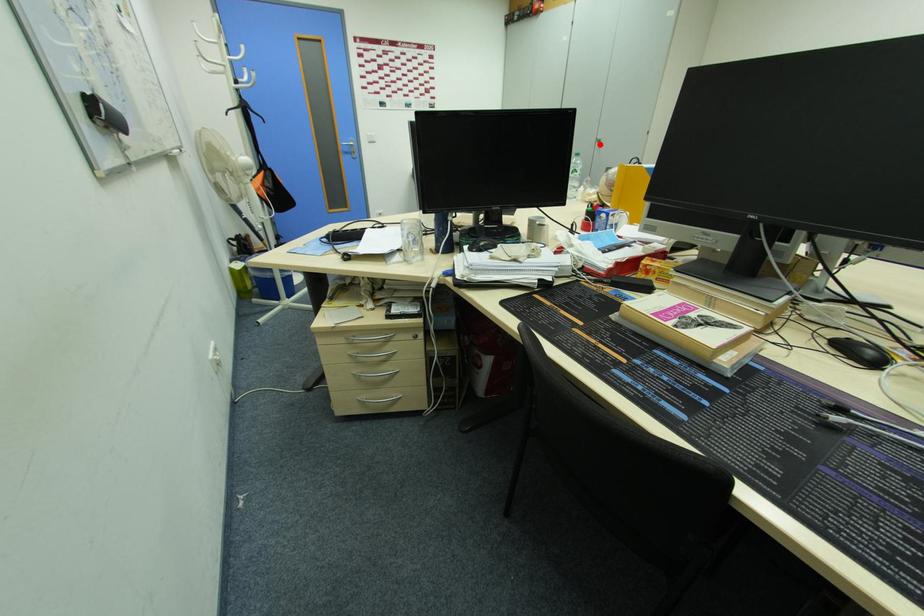
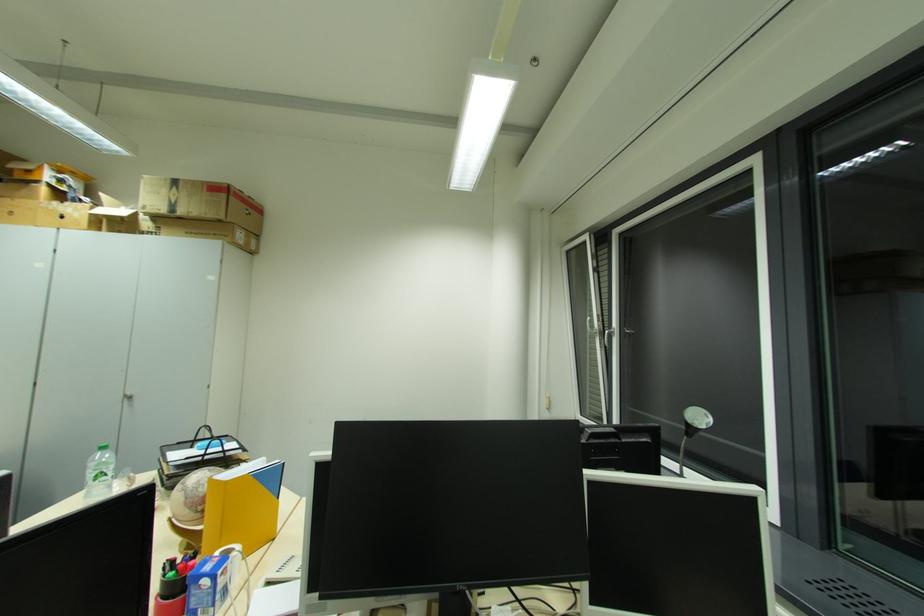
In the second image, find the point that corresponds to the highlighted location in the first image.

(128, 400)